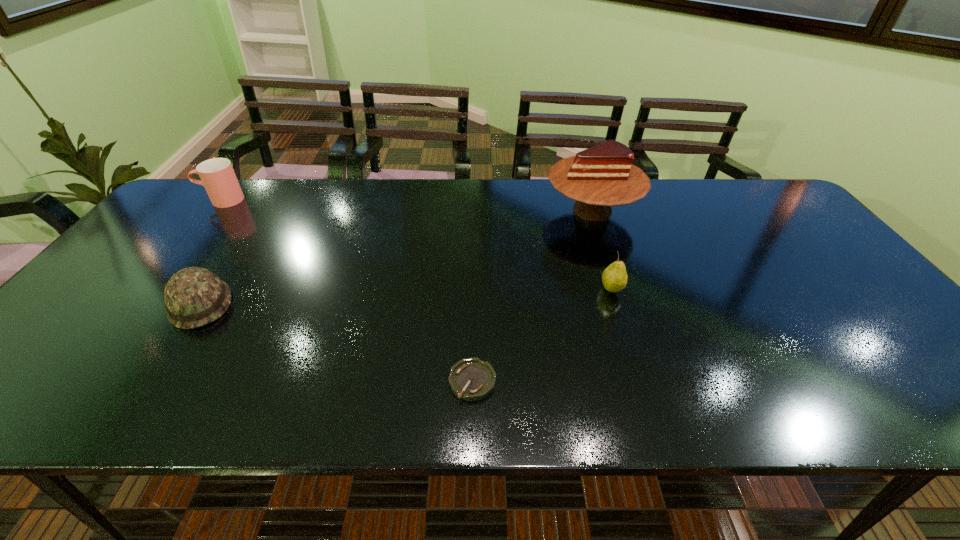
In order to click on free point located on the back of the second object from left to right in this screenshot , I will do `click(252, 224)`.

Find the location of a particular element. The width and height of the screenshot is (960, 540). vacant space situated 0.050m on the left of the ashtray is located at coordinates (424, 381).

Identify the location of cake that is at the far edge. The width and height of the screenshot is (960, 540). (602, 176).

Find the location of a particular element. This screenshot has width=960, height=540. cup that is at the far edge is located at coordinates (217, 175).

Locate an element on the screen. The image size is (960, 540). object that is at the near edge is located at coordinates (471, 379).

Identify the location of object located in the left edge section of the desktop. (217, 175).

Image resolution: width=960 pixels, height=540 pixels. What are the coordinates of `object at the far left corner` in the screenshot? It's located at (217, 175).

Identify the location of blank area at the far edge. (692, 212).

In the image, there is a desktop. In order to click on free region at the left edge in this screenshot , I will do `click(150, 243)`.

Locate an element on the screen. The image size is (960, 540). vacant space at the right edge of the desktop is located at coordinates click(829, 260).